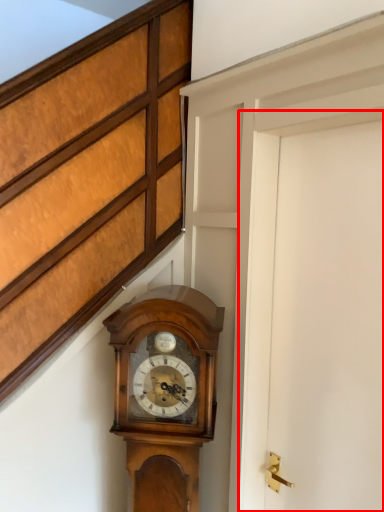
Question: From the image, what is the correct spatial relationship of door (annotated by the red box) in relation to wall clock?

Choices:
 (A) right
 (B) left

Answer: (A)